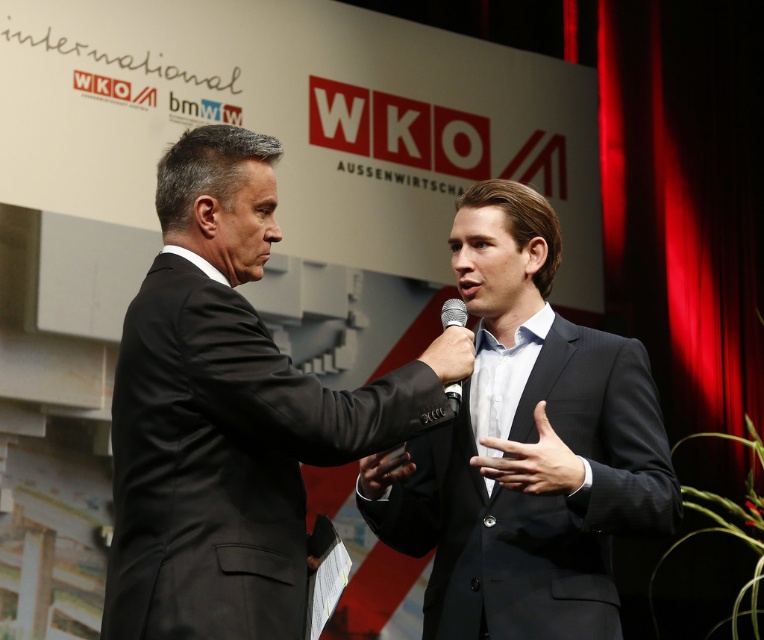
You are an event organizer who needs to ensure that all microphones are visible to the audience. Based on the scene, will the silver metallic microphone at center be visible to the audience if the black smooth suit at center is in front of it?

The black smooth suit at center is taller than the silver metallic microphone at center, so if the suit is in front of the microphone, it may block the audience from seeing the microphone.

You are standing at the back of the stage and want to walk towards the point that is closer to the front. Which point should you go to, point (549, 480) or point (450, 314)?

You should go to point (549, 480) because it is in front of point (450, 314), meaning it is closer to the front of the stage.

You are a stagehand setting up for a presentation. You need to adjust the microphones so that the silver metallic microphone at center is behind the black plastic microphone at center. Which microphone should you move and in which direction?

The silver metallic microphone at center should be moved backward so that it is behind the black plastic microphone at center.